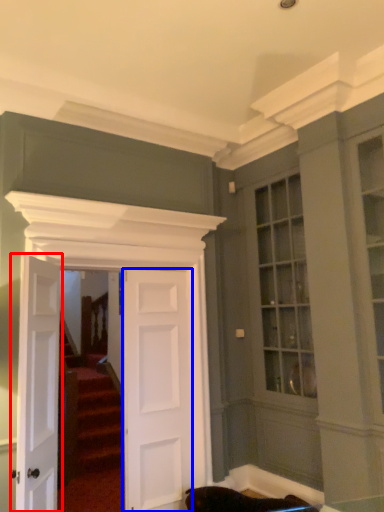
Question: Which object appears farthest to the camera in this image, door (highlighted by a red box) or door (highlighted by a blue box)?

Choices:
 (A) door
 (B) door

Answer: (B)